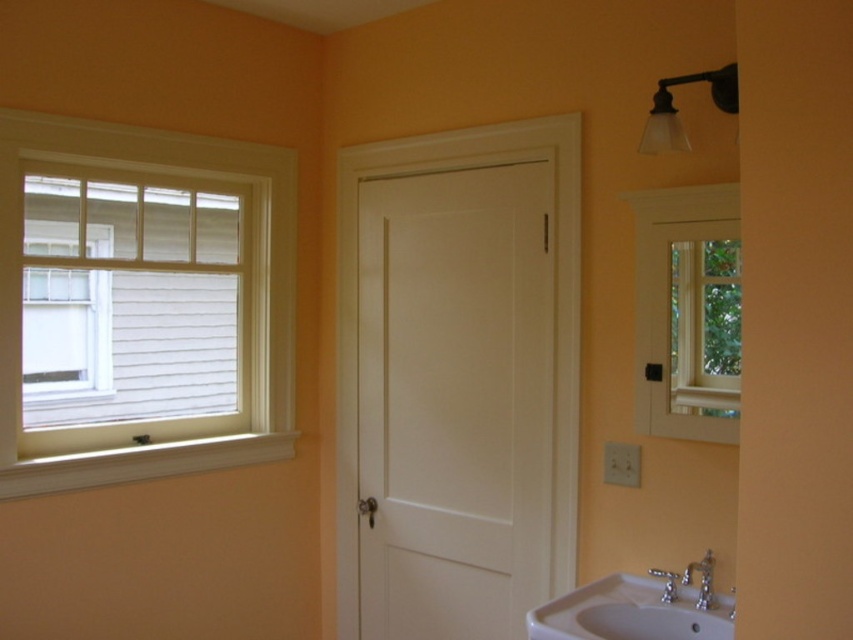
Can you confirm if white porcelain sink at lower right is smaller than silver metallic faucet at lower right?

No, white porcelain sink at lower right is not smaller than silver metallic faucet at lower right.

Does white porcelain sink at lower right appear on the right side of silver metallic faucet at lower right?

Incorrect, white porcelain sink at lower right is not on the right side of silver metallic faucet at lower right.

Where is `white porcelain sink at lower right`? This screenshot has height=640, width=853. white porcelain sink at lower right is located at coordinates (631, 611).

What are the coordinates of `white porcelain sink at lower right` in the screenshot? It's located at (631, 611).

Between white painted wood window at left and white porcelain sink at lower right, which one is positioned higher?

white painted wood window at left is above.

Which is in front, point (48, 404) or point (531, 621)?

Positioned in front is point (531, 621).

Which is behind, point (49, 248) or point (660, 577)?

Positioned behind is point (49, 248).

What are the coordinates of `white painted wood window at left` in the screenshot? It's located at (142, 301).

Can you confirm if white painted wood window at left is positioned below silver metallic faucet at lower right?

No.

Looking at this image, can you confirm if white painted wood window at left is wider than silver metallic faucet at lower right?

Yes, white painted wood window at left is wider than silver metallic faucet at lower right.

Locate an element on the screen. white painted wood window at left is located at coordinates (142, 301).

Where is `white painted wood window at left`? white painted wood window at left is located at coordinates (142, 301).